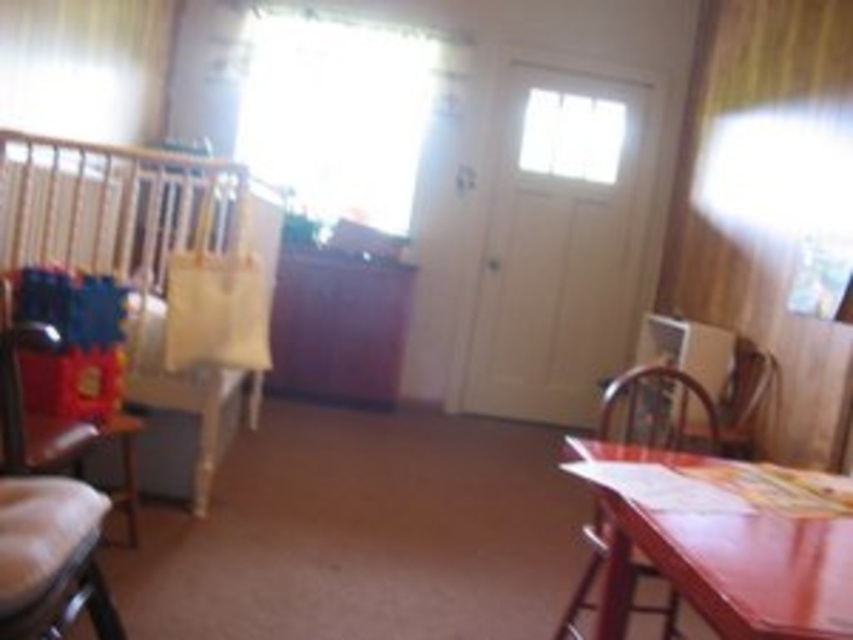
You are a parent trying to place a new toy on the wooden paneling at upper right and the wooden table at lower right. Which surface has a smaller width?

The wooden paneling at upper right has a lesser width compared to the wooden table at lower right, so the wooden paneling at upper right is smaller in width.

In the scene shown: You are a parent trying to choose seating for your child. You have two options in the room, the wooden chair at right and the brown leather armchair at right. Which one is bigger?

The wooden chair at right is larger in size compared to the brown leather armchair at right, so the wooden chair at right is bigger.

You are a parent trying to place a new toy on the shelf between the white sheer curtain at upper left and the wooden chair at right. Can you fit it there?

The white sheer curtain at upper left is to the left of the wooden chair at right, so there is space between them to place the new toy.